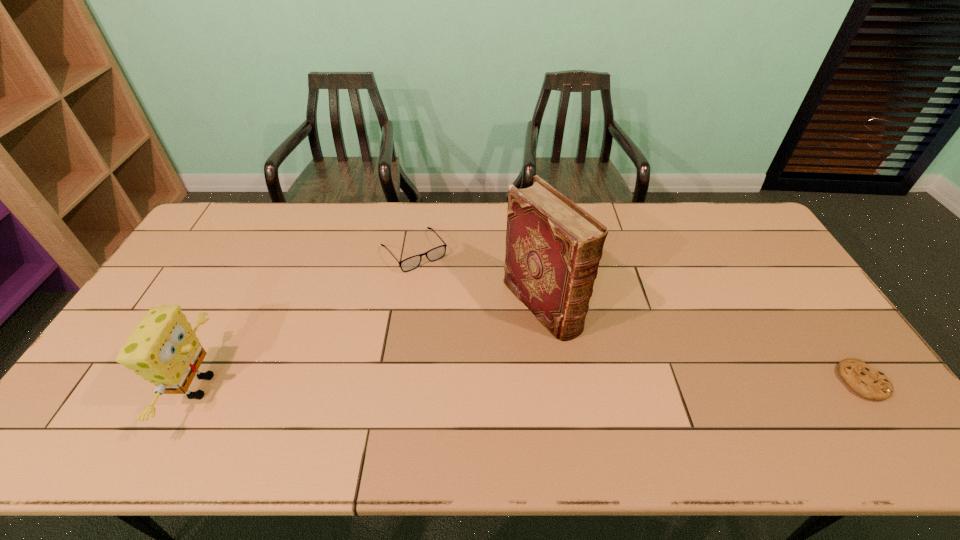
This screenshot has width=960, height=540. Find the location of `empty location between the hardback book and the cookie`. empty location between the hardback book and the cookie is located at coordinates (702, 343).

The width and height of the screenshot is (960, 540). Identify the location of vacant region between the shortest object and the leftmost object. (531, 384).

I want to click on empty space between the shortest object and the hardback book, so click(702, 343).

Where is `vacant point located between the second tallest object and the spectacles`? This screenshot has height=540, width=960. vacant point located between the second tallest object and the spectacles is located at coordinates (307, 319).

In order to click on unoccupied position between the sponge and the second shortest object in this screenshot , I will do `click(307, 319)`.

Image resolution: width=960 pixels, height=540 pixels. Identify the location of vacant region between the rightmost object and the hardback book. (702, 343).

What are the coordinates of `free spot between the second shortest object and the shortest object` in the screenshot? It's located at (638, 316).

Where is `free space between the rightmost object and the hardback book`? free space between the rightmost object and the hardback book is located at coordinates (702, 343).

Locate an element on the screen. This screenshot has width=960, height=540. free space between the leftmost object and the tallest object is located at coordinates (371, 346).

Where is `object that stands as the third closest to the cookie`? The image size is (960, 540). object that stands as the third closest to the cookie is located at coordinates (163, 349).